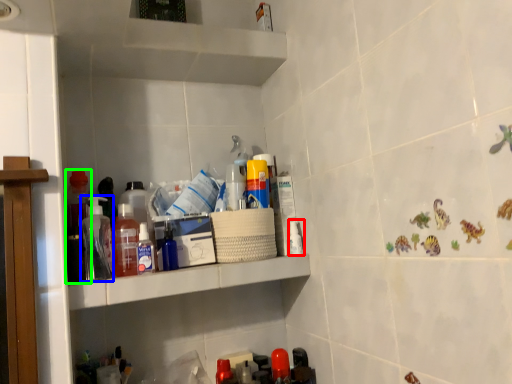
Question: Which is nearer to the toiletry (highlighted by a red box)? bottle (highlighted by a blue box) or bottle (highlighted by a green box).

Choices:
 (A) bottle
 (B) bottle

Answer: (A)